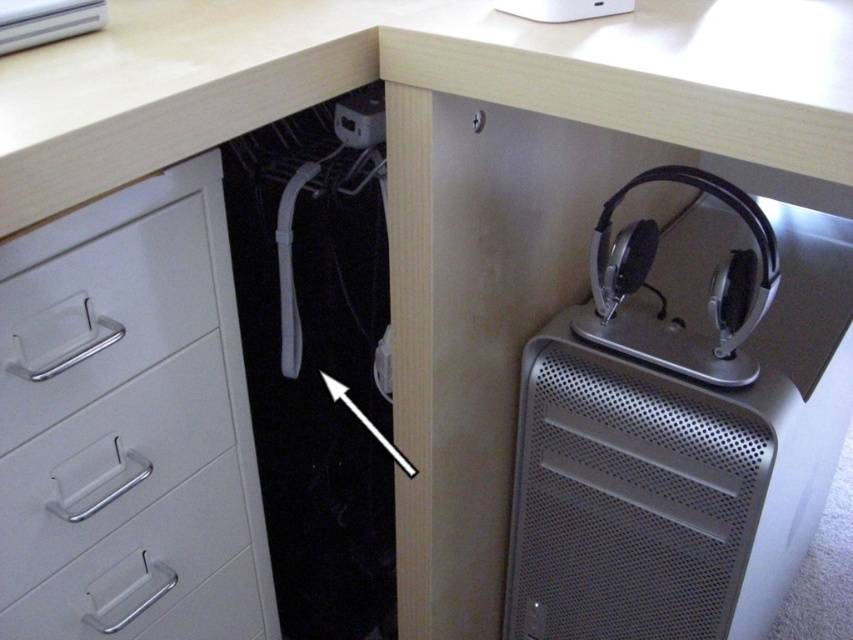
Describe the element at coordinates (128, 424) in the screenshot. The width and height of the screenshot is (853, 640). I see `white plastic file cabinet at left` at that location.

Does point (238, 612) come farther from viewer compared to point (403, 468)?

That is False.

Find the location of a particular element. Image resolution: width=853 pixels, height=640 pixels. white plastic file cabinet at left is located at coordinates (128, 424).